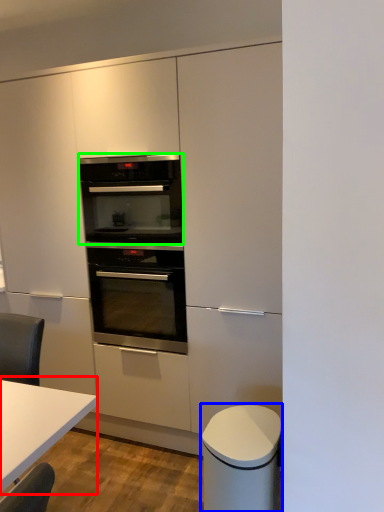
Question: Considering the real-world distances, which object is farthest from table (highlighted by a red box)? cabinetry (highlighted by a blue box) or oven (highlighted by a green box)?

Choices:
 (A) cabinetry
 (B) oven

Answer: (B)